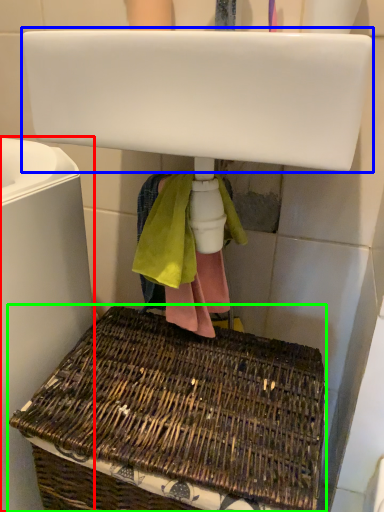
Question: Which object is positioned closest to bath (highlighted by a red box)? Select from sink (highlighted by a blue box) and picnic basket (highlighted by a green box).

Choices:
 (A) sink
 (B) picnic basket

Answer: (B)